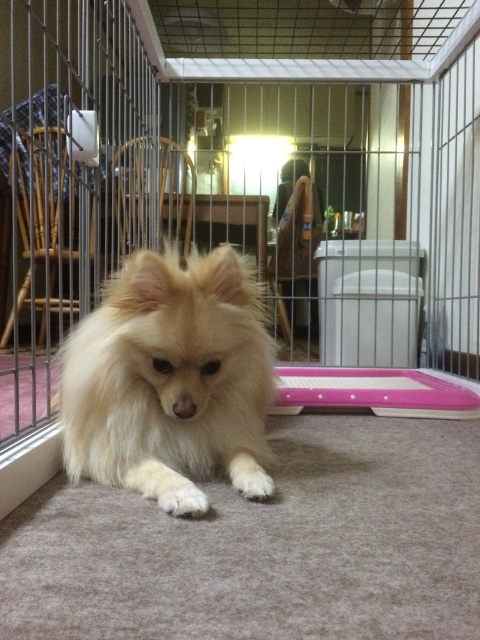
Does point (402, 108) lie in front of point (168, 336)?

That is False.

From the picture: Between transparent glass door at center and fluffy white dog at center, which one has more height?

transparent glass door at center is taller.

Measure the distance between point [351,124] and camera.

They are 4.12 meters apart.

Where is `transparent glass door at center`? This screenshot has width=480, height=640. transparent glass door at center is located at coordinates (311, 205).